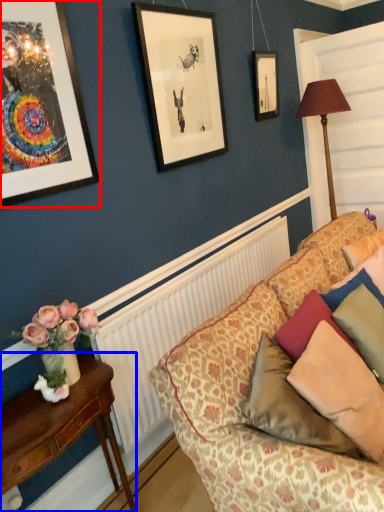
Question: Which point is closer to the camera, picture frame (highlighted by a red box) or table (highlighted by a blue box)?

Choices:
 (A) picture frame
 (B) table

Answer: (B)